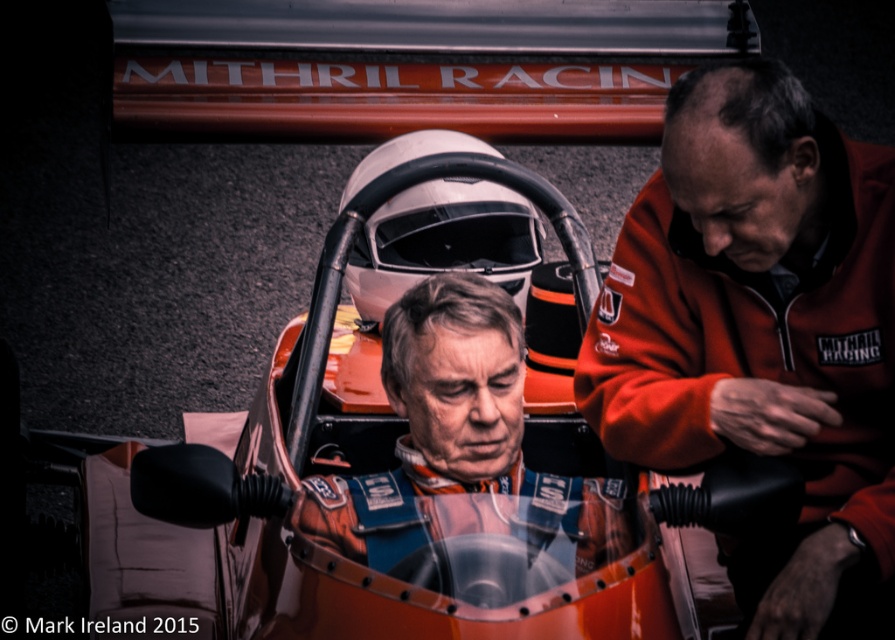
Can you confirm if orange softshell jacket at right is positioned above matte orange racing suit at center?

Correct, orange softshell jacket at right is located above matte orange racing suit at center.

Who is taller, orange softshell jacket at right or matte orange racing suit at center?

orange softshell jacket at right is taller.

Consider the image. Who is more forward, (837, 476) or (431, 344)?

Point (837, 476)

Identify the location of orange softshell jacket at right. The image size is (895, 640). (763, 337).

Is orange metallic car at center closer to the viewer compared to orange softshell jacket at right?

Yes.

Between orange metallic car at center and orange softshell jacket at right, which one appears on the left side from the viewer's perspective?

From the viewer's perspective, orange metallic car at center appears more on the left side.

What do you see at coordinates (411, 464) in the screenshot?
I see `orange metallic car at center` at bounding box center [411, 464].

Where is `orange metallic car at center`? orange metallic car at center is located at coordinates coord(411,464).

Is orange metallic car at center below matte orange racing suit at center?

Actually, orange metallic car at center is above matte orange racing suit at center.

Identify the location of orange metallic car at center. The image size is (895, 640). (411, 464).